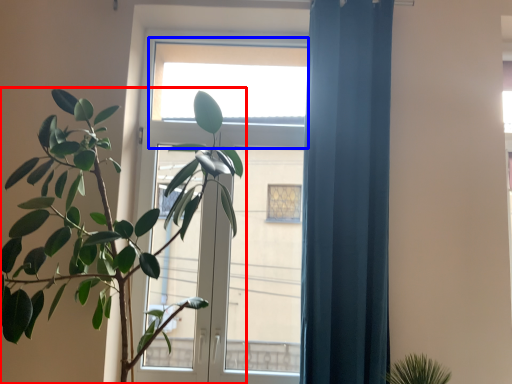
Question: Among these objects, which one is nearest to the camera, houseplant (highlighted by a red box) or window (highlighted by a blue box)?

Choices:
 (A) houseplant
 (B) window

Answer: (A)